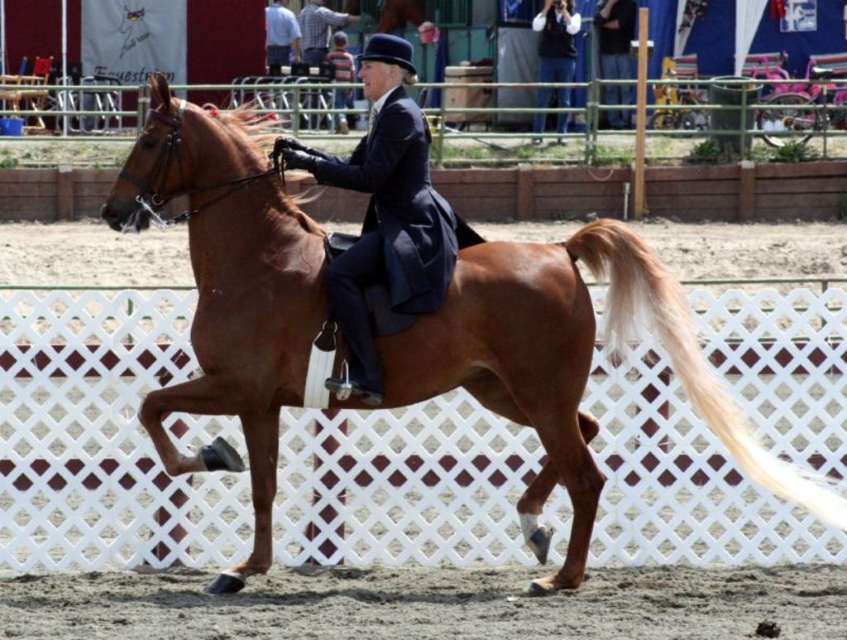
Question: Can you confirm if brown glossy horse at center is bigger than shiny navy blue riding jacket at center?

Choices:
 (A) no
 (B) yes

Answer: (B)

Question: Can you confirm if brown glossy horse at center is positioned above shiny navy blue riding jacket at center?

Choices:
 (A) no
 (B) yes

Answer: (A)

Question: Which of the following is the farthest from the observer?

Choices:
 (A) brown glossy horse at center
 (B) shiny navy blue riding jacket at center

Answer: (B)

Question: Which of the following is the farthest from the observer?

Choices:
 (A) (385, 134)
 (B) (148, 125)

Answer: (A)

Question: Is brown glossy horse at center bigger than shiny navy blue riding jacket at center?

Choices:
 (A) no
 (B) yes

Answer: (B)